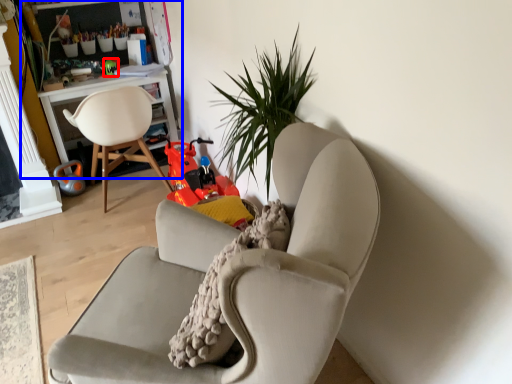
Question: Which point is further to the camera, toy (highlighted by a red box) or bookshelf (highlighted by a blue box)?

Choices:
 (A) toy
 (B) bookshelf

Answer: (A)